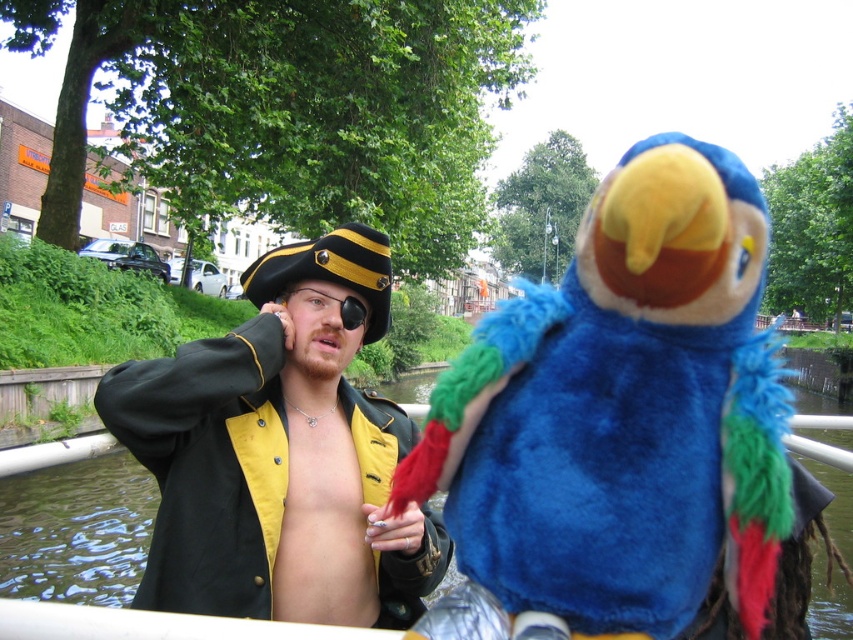
From the picture: Is blue plush parrot at upper right positioned behind matte black pirate hat at upper center?

No, it is in front of matte black pirate hat at upper center.

Is blue plush parrot at upper right above matte black pirate hat at upper center?

Yes.

Is point (631, 529) positioned in front of point (236, 547)?

Yes, point (631, 529) is in front of point (236, 547).

Where is `blue plush parrot at upper right`? blue plush parrot at upper right is located at coordinates (618, 420).

Is blue plush parrot at upper right positioned at the back of skinny yellow/yellowish leather at center?

No, it is in front of skinny yellow/yellowish leather at center.

Which is below, blue plush parrot at upper right or skinny yellow/yellowish leather at center?

skinny yellow/yellowish leather at center is below.

Is point (722, 452) closer to viewer compared to point (277, 596)?

Yes, point (722, 452) is in front of point (277, 596).

Find the location of a particular element. This screenshot has height=640, width=853. blue plush parrot at upper right is located at coordinates (618, 420).

Can you confirm if matte black pirate hat at upper center is positioned to the left of skinny yellow/yellowish leather at center?

Indeed, matte black pirate hat at upper center is positioned on the left side of skinny yellow/yellowish leather at center.

Is point (229, 602) in front of point (316, 456)?

Yes, it is in front of point (316, 456).

Who is more forward, (270, 300) or (364, 547)?

Point (364, 547) is more forward.

This screenshot has height=640, width=853. I want to click on matte black pirate hat at upper center, so click(280, 452).